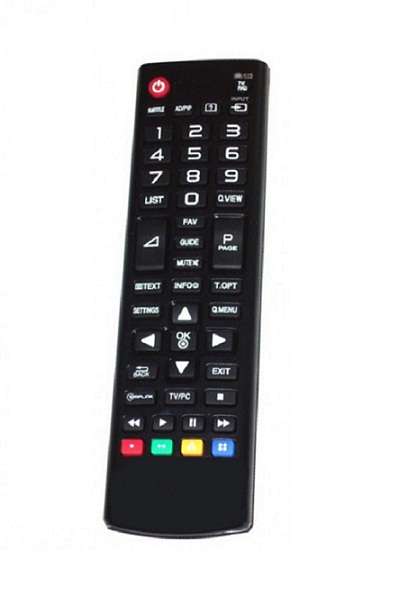
Where is `numbers on remote`? The width and height of the screenshot is (400, 604). numbers on remote is located at coordinates (161, 126), (195, 127), (230, 127), (230, 145), (187, 155), (170, 153), (165, 176), (208, 176), (232, 176), (194, 204).